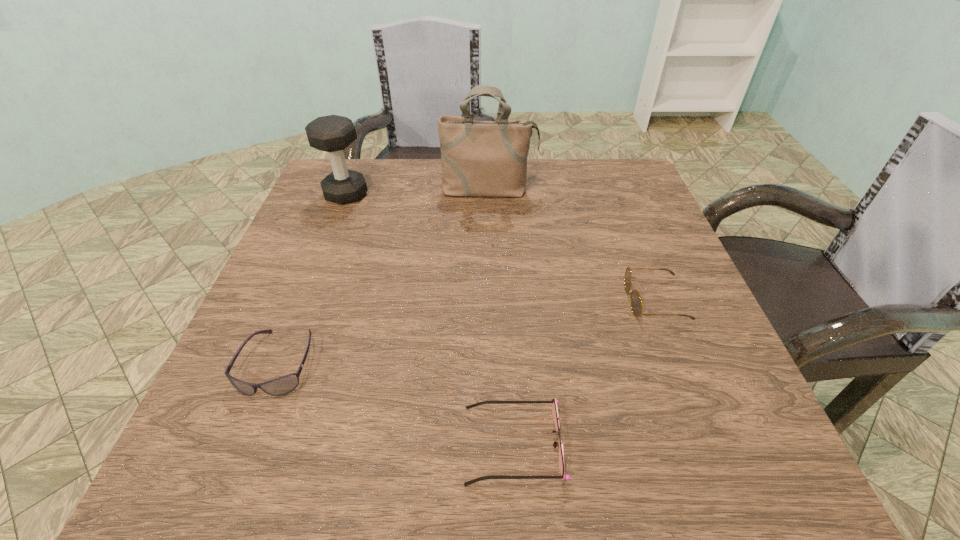
This screenshot has width=960, height=540. In order to click on object that is the fourth closest to the tallest object in this screenshot , I will do `click(554, 407)`.

Point out which object is positioned as the second nearest to the third farthest object. Please provide its 2D coordinates. Your answer should be formatted as a tuple, i.e. [(x, y)], where the tuple contains the x and y coordinates of a point satisfying the conditions above.

[(478, 158)]

Locate which sunglasses ranks second in proximity to the fourth shortest object. Please provide its 2D coordinates. Your answer should be formatted as a tuple, i.e. [(x, y)], where the tuple contains the x and y coordinates of a point satisfying the conditions above.

[(554, 407)]

At what (x,y) coordinates should I click in order to perform the action: click on sunglasses that can be found as the second closest to the third nearest object. Please return your answer as a coordinate pair (x, y). The image size is (960, 540). Looking at the image, I should click on pos(283,385).